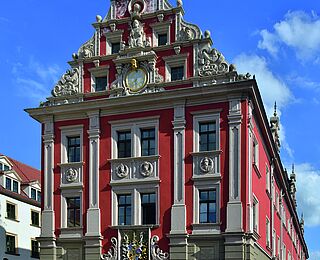
Image resolution: width=320 pixels, height=260 pixels. Identify the location of red paint. (161, 144).